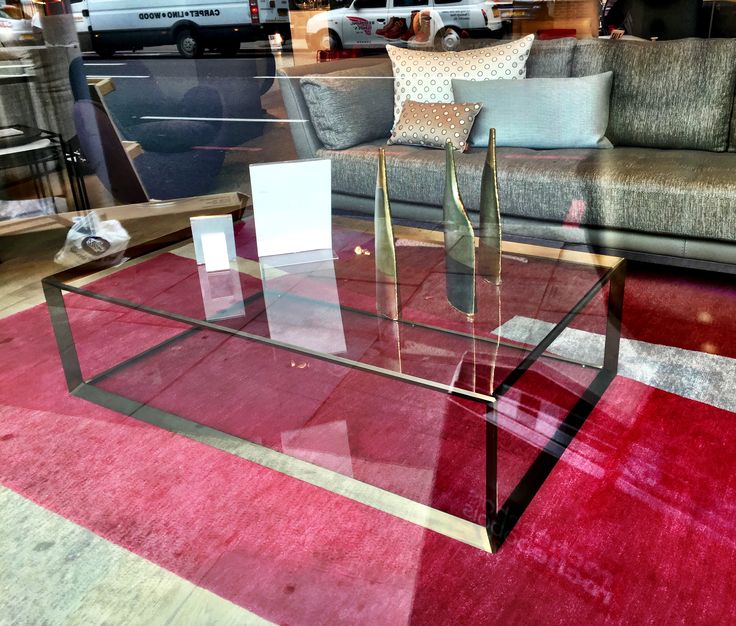
Locate an element on the screen. The height and width of the screenshot is (626, 736). fabrics is located at coordinates (656, 173), (650, 493), (99, 118), (414, 81).